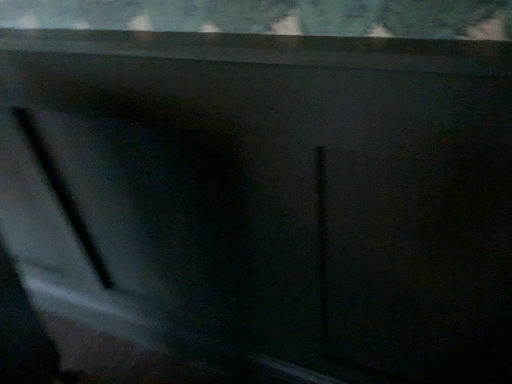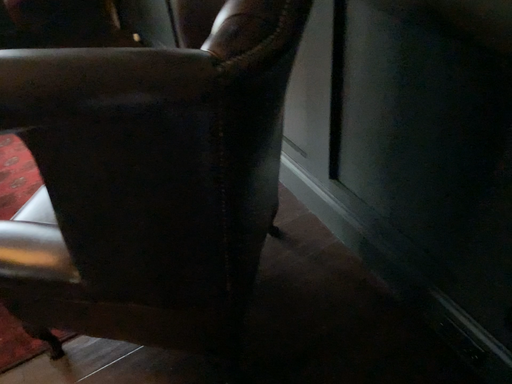
Question: Which way did the camera rotate in the video?

Choices:
 (A) rotated left
 (B) rotated right

Answer: (A)